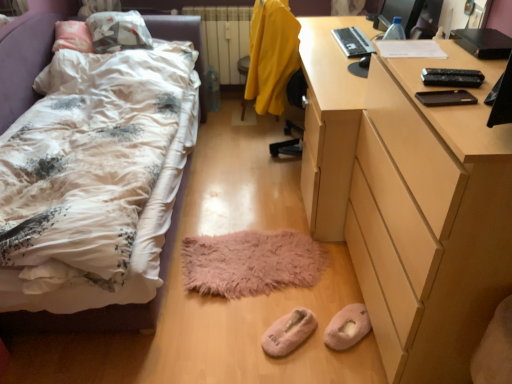
Question: Is black plastic laptop at upper right thinner than pink fluffy slippers at lower center, the 1th footwear from the left?

Choices:
 (A) no
 (B) yes

Answer: (B)

Question: From a real-world perspective, does black plastic laptop at upper right sit lower than pink fluffy slippers at lower center, the 1th footwear from the left?

Choices:
 (A) yes
 (B) no

Answer: (B)

Question: Is black plastic laptop at upper right to the right of pink fluffy slippers at lower center, the 1th footwear from the left, from the viewer's perspective?

Choices:
 (A) no
 (B) yes

Answer: (B)

Question: From the image's perspective, is black plastic laptop at upper right located beneath pink fluffy slippers at lower center, the 1th footwear from the left?

Choices:
 (A) yes
 (B) no

Answer: (B)

Question: Is black plastic laptop at upper right next to pink fluffy slippers at lower center, the 1th footwear from the left, and touching it?

Choices:
 (A) no
 (B) yes

Answer: (A)

Question: Is black plastic laptop at upper right further to camera compared to pink fluffy slippers at lower center, the 1th footwear from the left?

Choices:
 (A) yes
 (B) no

Answer: (A)

Question: Can you confirm if fluffy white bed at left is taller than fuzzy pink mat at center?

Choices:
 (A) yes
 (B) no

Answer: (A)

Question: Does fluffy white bed at left have a lesser height compared to fuzzy pink mat at center?

Choices:
 (A) yes
 (B) no

Answer: (B)

Question: Considering the relative sizes of fluffy white bed at left and fuzzy pink mat at center in the image provided, is fluffy white bed at left wider than fuzzy pink mat at center?

Choices:
 (A) no
 (B) yes

Answer: (B)

Question: Does fluffy white bed at left have a smaller size compared to fuzzy pink mat at center?

Choices:
 (A) no
 (B) yes

Answer: (A)

Question: Considering the relative sizes of fluffy white bed at left and fuzzy pink mat at center in the image provided, is fluffy white bed at left thinner than fuzzy pink mat at center?

Choices:
 (A) no
 (B) yes

Answer: (A)

Question: Can you confirm if fluffy white bed at left is bigger than fuzzy pink mat at center?

Choices:
 (A) no
 (B) yes

Answer: (B)

Question: Is light brown wooden desk at right facing towards yellow fabric swivel chair at center?

Choices:
 (A) yes
 (B) no

Answer: (B)